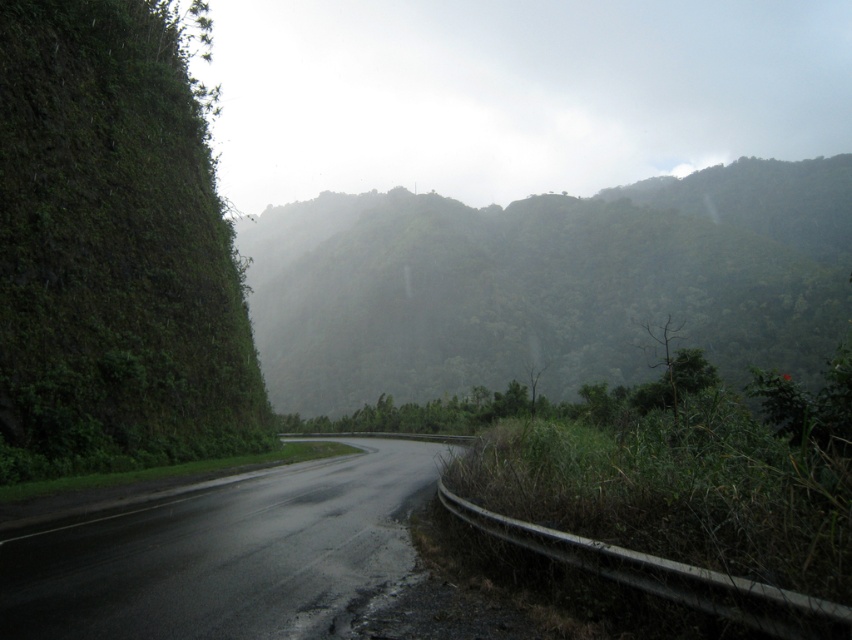
Question: Which of the following is the farthest from the observer?

Choices:
 (A) (321, 332)
 (B) (367, 554)
 (C) (205, 262)

Answer: (A)

Question: Where is green leafy mountain at center located in relation to black asphalt road at center in the image?

Choices:
 (A) right
 (B) left

Answer: (A)

Question: Which point is farther to the camera?

Choices:
 (A) green leafy wall at left
 (B) black asphalt road at center

Answer: (A)

Question: Which point appears closest to the camera in this image?

Choices:
 (A) (452, 316)
 (B) (301, 588)
 (C) (111, 444)

Answer: (B)

Question: Does green leafy mountain at center have a smaller size compared to black asphalt road at center?

Choices:
 (A) no
 (B) yes

Answer: (A)

Question: Is green leafy mountain at center below black asphalt road at center?

Choices:
 (A) no
 (B) yes

Answer: (A)